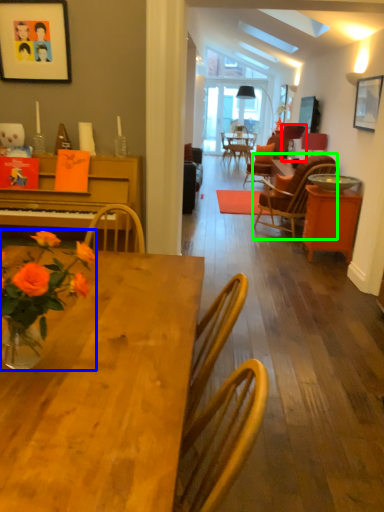
Question: Estimate the real-world distances between objects in this image. Which object is closer to lamp (highlighted by a red box), flower (highlighted by a blue box) or chair (highlighted by a green box)?

Choices:
 (A) flower
 (B) chair

Answer: (B)